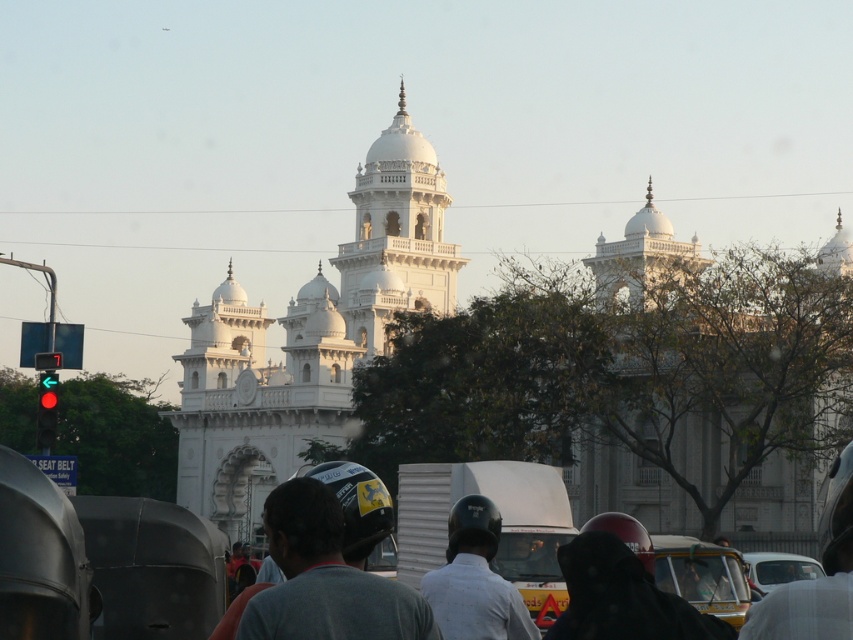
Which is above, white marble palace at center or white glossy car at center?

white marble palace at center is above.

Is white marble palace at center taller than white glossy car at center?

Yes.

Which is in front, point (432, 401) or point (752, 582)?

Point (752, 582) is in front.

You are a GUI agent. You are given a task and a screenshot of the screen. Output one action in this format:
    pyautogui.click(x=<x>, y=<y>)
    Task: Click on the white marble palace at center
    
    Given the screenshot: What is the action you would take?
    pyautogui.click(x=537, y=355)

Measure the distance from white marble palace at center to white marble tower at center.

The distance of white marble palace at center from white marble tower at center is 21.19 feet.

Is white marble palace at center to the left of white marble tower at center from the viewer's perspective?

In fact, white marble palace at center is to the right of white marble tower at center.

The image size is (853, 640). In order to click on white marble palace at center in this screenshot , I will do click(537, 355).

Where is `white marble palace at center`? The image size is (853, 640). white marble palace at center is located at coordinates (537, 355).

Does yellow matte taxi at lower right appear on the right side of white glossy car at center?

Incorrect, yellow matte taxi at lower right is not on the right side of white glossy car at center.

Between yellow matte taxi at lower right and white glossy car at center, which one is positioned higher?

yellow matte taxi at lower right

This screenshot has width=853, height=640. Describe the element at coordinates (701, 576) in the screenshot. I see `yellow matte taxi at lower right` at that location.

Find the location of a particular element. This screenshot has height=640, width=853. yellow matte taxi at lower right is located at coordinates (701, 576).